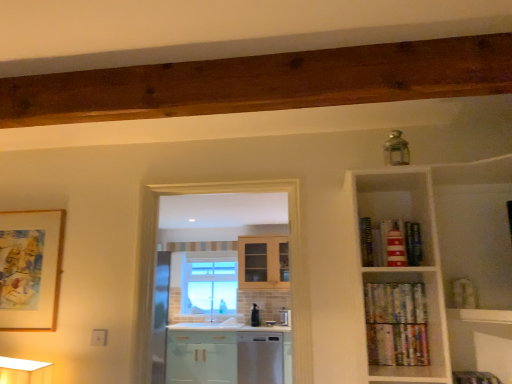
Question: In the image, is red striped lighthouse at upper right, placed as the 1th book when sorted from top to bottom, positioned in front of or behind clear glass window at center?

Choices:
 (A) front
 (B) behind

Answer: (A)

Question: Is red striped lighthouse at upper right, which appears as the third book when ordered from the bottom, situated inside clear glass window at center or outside?

Choices:
 (A) inside
 (B) outside

Answer: (B)

Question: Which object is the farthest from the wooden picture frame at left?

Choices:
 (A) multicolored paperbacks at lower right, the first book from the bottom
 (B) red striped lighthouse at upper right, placed as the 1th book when sorted from top to bottom
 (C) metallic stainless steel kettle at center
 (D) clear glass window at center
 (E) satin white dishwasher at center

Answer: (D)

Question: Which object is positioned closest to the clear glass window at center?

Choices:
 (A) red striped lighthouse at upper right, which appears as the third book when ordered from the bottom
 (B) multicolored paperbacks at lower right, the first book from the bottom
 (C) satin white dishwasher at center
 (D) wooden picture frame at left
 (E) hardcover books at right, the second book positioned from the top

Answer: (C)